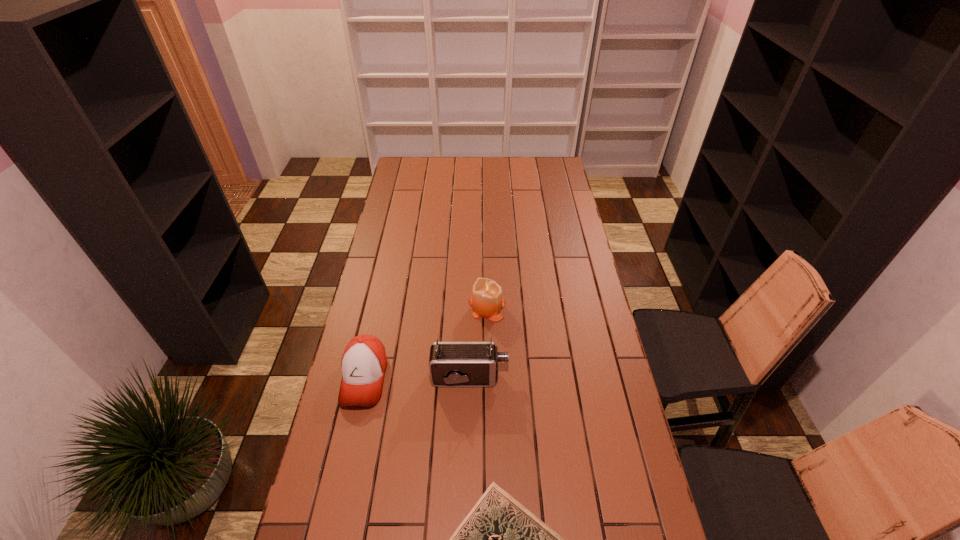
In order to click on camcorder in this screenshot , I will do `click(451, 364)`.

This screenshot has height=540, width=960. What are the coordinates of `the farthest object` in the screenshot? It's located at (486, 299).

You are a GUI agent. You are given a task and a screenshot of the screen. Output one action in this format:
    pyautogui.click(x=<x>, y=<y>)
    Task: Click on the second tallest object
    
    Given the screenshot: What is the action you would take?
    pyautogui.click(x=486, y=299)

Where is `the leftmost object`? The width and height of the screenshot is (960, 540). the leftmost object is located at coordinates (363, 364).

Locate an element on the screen. The width and height of the screenshot is (960, 540). the third tallest object is located at coordinates (363, 364).

Locate an element on the screen. This screenshot has width=960, height=540. vacant space situated 0.330m at the lens of the camcorder is located at coordinates (608, 377).

Where is `vacant space located on the right of the farthest object`? This screenshot has height=540, width=960. vacant space located on the right of the farthest object is located at coordinates (521, 307).

The image size is (960, 540). In order to click on vacant area situated 0.150m on the front-facing side of the leftmost object in this screenshot , I will do `click(346, 461)`.

The image size is (960, 540). Identify the location of object located in the left edge section of the desktop. (363, 364).

Image resolution: width=960 pixels, height=540 pixels. What are the coordinates of `free space at the left edge of the desktop` in the screenshot? It's located at pos(389,302).